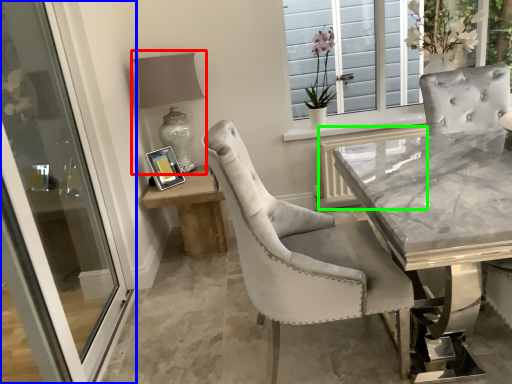
Question: Estimate the real-world distances between objects in this image. Which object is closer to table lamp (highlighted by a red box), door (highlighted by a blue box) or shutter (highlighted by a green box)?

Choices:
 (A) door
 (B) shutter

Answer: (A)